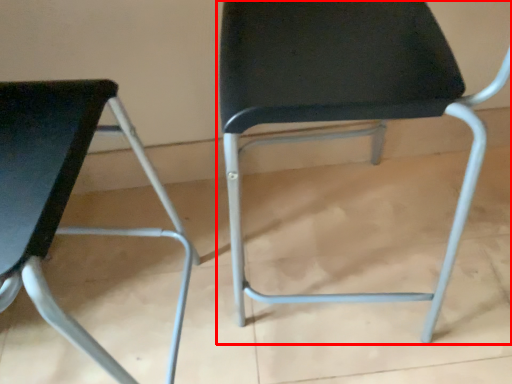
Question: From the image's perspective, considering the relative positions of chair (annotated by the red box) and chair in the image provided, where is chair (annotated by the red box) located with respect to the staircase?

Choices:
 (A) below
 (B) above

Answer: (B)